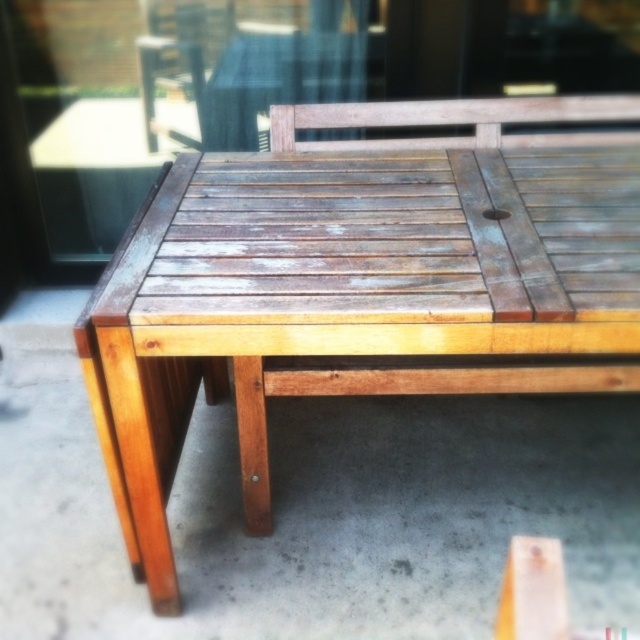
Question: Does weathered wood picnic table at center have a lesser width compared to transparent wood table at center?

Choices:
 (A) yes
 (B) no

Answer: (B)

Question: Is weathered wood picnic table at center to the left of transparent wood table at center from the viewer's perspective?

Choices:
 (A) no
 (B) yes

Answer: (A)

Question: Among these objects, which one is farthest from the camera?

Choices:
 (A) weathered wood picnic table at center
 (B) transparent wood table at center

Answer: (B)

Question: Which point is closer to the camera taking this photo?

Choices:
 (A) (51, 77)
 (B) (248, 387)

Answer: (B)

Question: Among these objects, which one is farthest from the camera?

Choices:
 (A) transparent wood table at center
 (B) weathered wood picnic table at center

Answer: (A)

Question: From the image, what is the correct spatial relationship of weathered wood picnic table at center in relation to transparent wood table at center?

Choices:
 (A) below
 (B) above

Answer: (A)